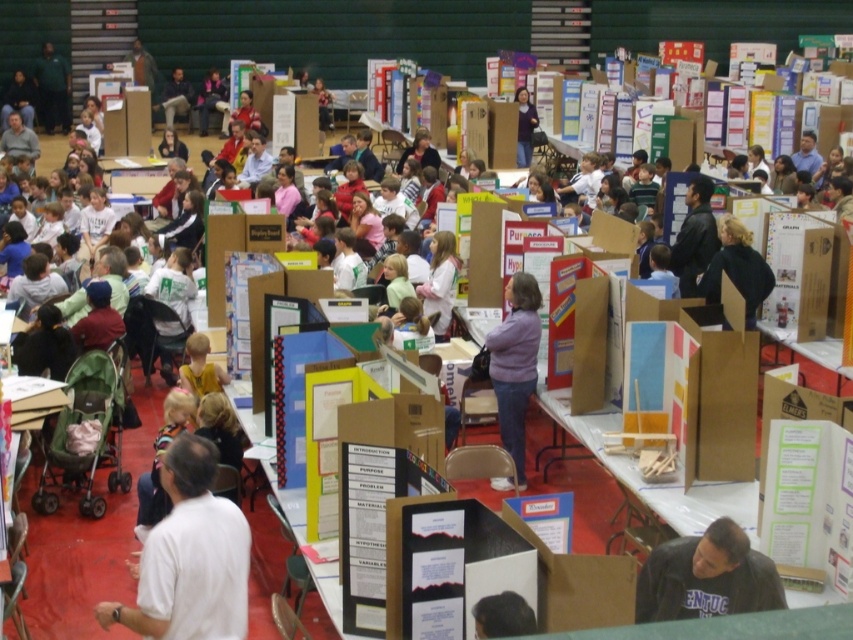
You are a photographer at the event and want to capture both the white shirt at lower left and the purple fabric shirt at center in a single frame. Which shirt should you focus on to ensure both are in the frame without zooming in too much?

You should focus on the white shirt at lower left because it is smaller than the purple fabric shirt at center, allowing both to fit within the frame without excessive zoom.

You are a photographer at the event and want to capture a photo of both the white shirt at lower left and the purple fabric shirt at center. However, you need to ensure that neither of them is blocking the other. Based on their positions, can you position yourself in a way that both are fully visible without any overlap?

Yes, since the white shirt at lower left is in front of the purple fabric shirt at center, you can position yourself behind the purple fabric shirt at center to capture both without overlap.

You are standing in the middle of the science fair hall. You see a white shirt at lower left and a dark gray sweatshirt at lower right. Which one is closer to your left side?

The white shirt at lower left is closer to your left side because it is positioned to the left of the dark gray sweatshirt at lower right.